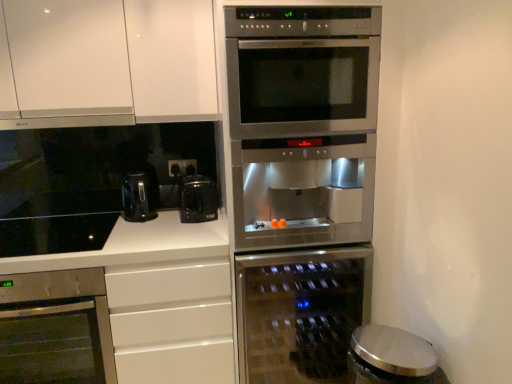
Question: From a real-world perspective, is stainless steel oven at lower left, positioned as the second oven in right-to-left order, beneath black glass cooktop at lower left?

Choices:
 (A) no
 (B) yes

Answer: (B)

Question: From a real-world perspective, is stainless steel oven at lower left, positioned as the second oven in right-to-left order, on top of black glass cooktop at lower left?

Choices:
 (A) yes
 (B) no

Answer: (B)

Question: Is stainless steel oven at lower left, acting as the first oven starting from the left, at the left side of black glass cooktop at lower left?

Choices:
 (A) no
 (B) yes

Answer: (A)

Question: Does stainless steel oven at lower left, positioned as the second oven in right-to-left order, have a larger size compared to black glass cooktop at lower left?

Choices:
 (A) no
 (B) yes

Answer: (B)

Question: Is stainless steel oven at lower left, acting as the first oven starting from the left, in contact with black glass cooktop at lower left?

Choices:
 (A) yes
 (B) no

Answer: (B)

Question: Are stainless steel oven at lower left, acting as the first oven starting from the left, and black glass cooktop at lower left far apart?

Choices:
 (A) no
 (B) yes

Answer: (A)

Question: Can you confirm if white glossy countertop at lower left is positioned to the left of white matte cabinet at upper left?

Choices:
 (A) yes
 (B) no

Answer: (A)

Question: From a real-world perspective, is white glossy countertop at lower left positioned under white matte cabinet at upper left based on gravity?

Choices:
 (A) no
 (B) yes

Answer: (B)

Question: From a real-world perspective, is white glossy countertop at lower left on top of white matte cabinet at upper left?

Choices:
 (A) yes
 (B) no

Answer: (B)

Question: Is white glossy countertop at lower left aimed at white matte cabinet at upper left?

Choices:
 (A) no
 (B) yes

Answer: (A)

Question: Is white glossy countertop at lower left outside white matte cabinet at upper left?

Choices:
 (A) no
 (B) yes

Answer: (B)

Question: Is white glossy countertop at lower left facing away from white matte cabinet at upper left?

Choices:
 (A) yes
 (B) no

Answer: (B)

Question: Is white glossy countertop at lower left with metallic silver trash can at lower right, marked as the 2th appliance in a back-to-front arrangement?

Choices:
 (A) no
 (B) yes

Answer: (A)